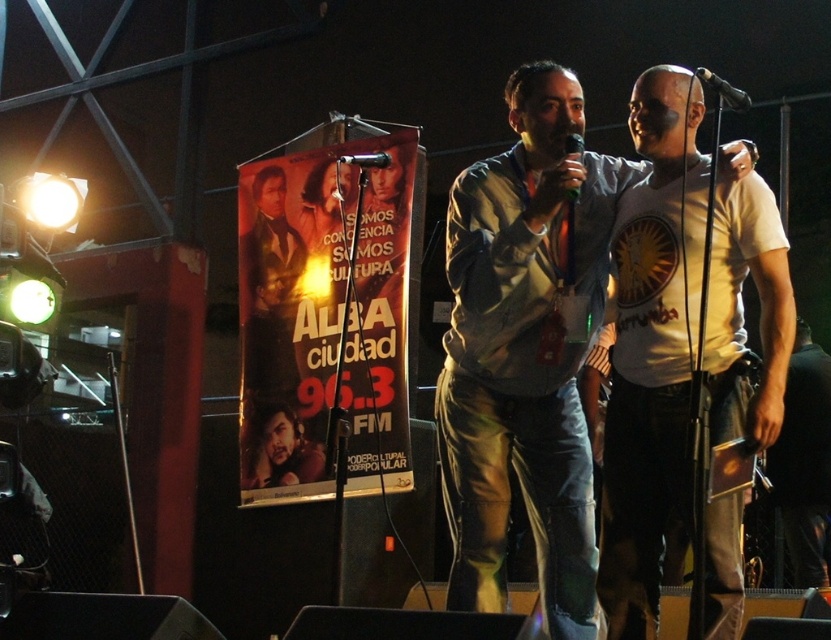
Question: Can you confirm if white cotton t-shirt at center is bigger than black matte microphone at center?

Choices:
 (A) no
 (B) yes

Answer: (B)

Question: Which point is farther to the camera?

Choices:
 (A) white cotton t-shirt at center
 (B) matte paper poster at center
 (C) black metallic microphone at upper right

Answer: (B)

Question: Among these points, which one is nearest to the camera?

Choices:
 (A) (817, 460)
 (B) (723, 99)
 (C) (381, 154)
 (D) (578, 141)

Answer: (B)

Question: Observing the image, what is the correct spatial positioning of black metallic microphone at upper right in reference to black plastic microphone at center?

Choices:
 (A) right
 (B) left

Answer: (A)

Question: Is dark gray jeans at center positioned at the back of black matte microphone at center?

Choices:
 (A) no
 (B) yes

Answer: (B)

Question: Which point appears farthest from the camera in this image?

Choices:
 (A) (766, 372)
 (B) (568, 198)
 (C) (362, 168)

Answer: (C)